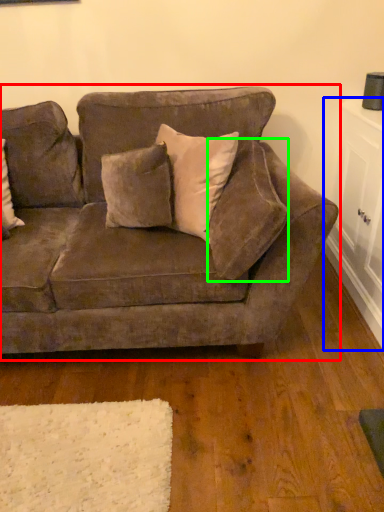
Question: Which object is positioned farthest from studio couch (highlighted by a red box)? Select from table (highlighted by a blue box) and pillow (highlighted by a green box).

Choices:
 (A) table
 (B) pillow

Answer: (A)